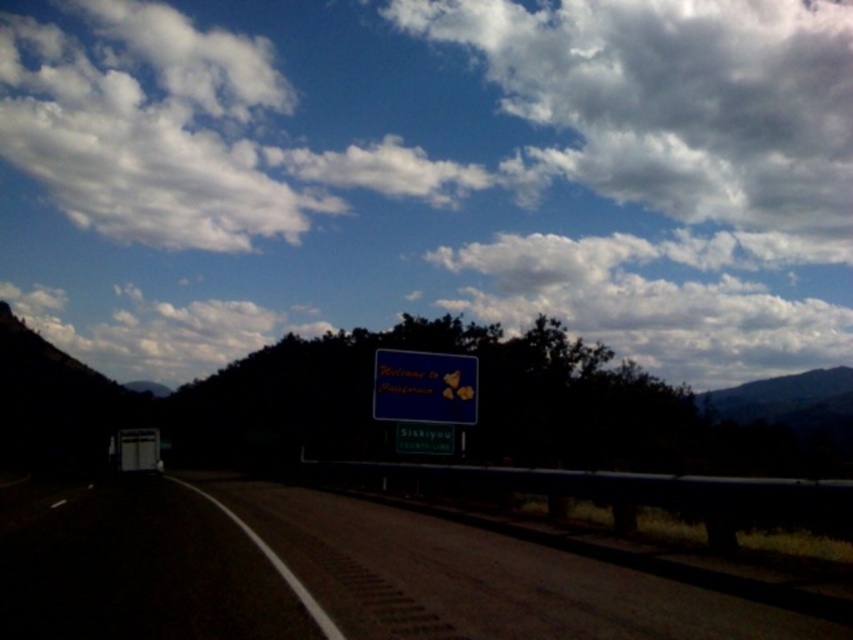
Question: Is cloudy blue sky at upper center wider than blue matte sign at center?

Choices:
 (A) yes
 (B) no

Answer: (A)

Question: Which point is closer to the camera taking this photo?

Choices:
 (A) (442, 36)
 (B) (469, 220)
 (C) (424, 428)
 (D) (653, 630)

Answer: (D)

Question: Can you confirm if dark asphalt road at center is positioned to the right of green matte sign at center?

Choices:
 (A) yes
 (B) no

Answer: (B)

Question: Among these objects, which one is nearest to the camera?

Choices:
 (A) dark asphalt road at center
 (B) blue matte sign at center

Answer: (A)

Question: Is the position of white fluffy cloud at upper center less distant than that of green matte sign at center?

Choices:
 (A) no
 (B) yes

Answer: (A)

Question: Which of these objects is positioned farthest from the white fluffy cloud at upper center?

Choices:
 (A) green matte sign at center
 (B) blue matte sign at center
 (C) cloudy blue sky at upper center
 (D) dark asphalt road at center

Answer: (B)